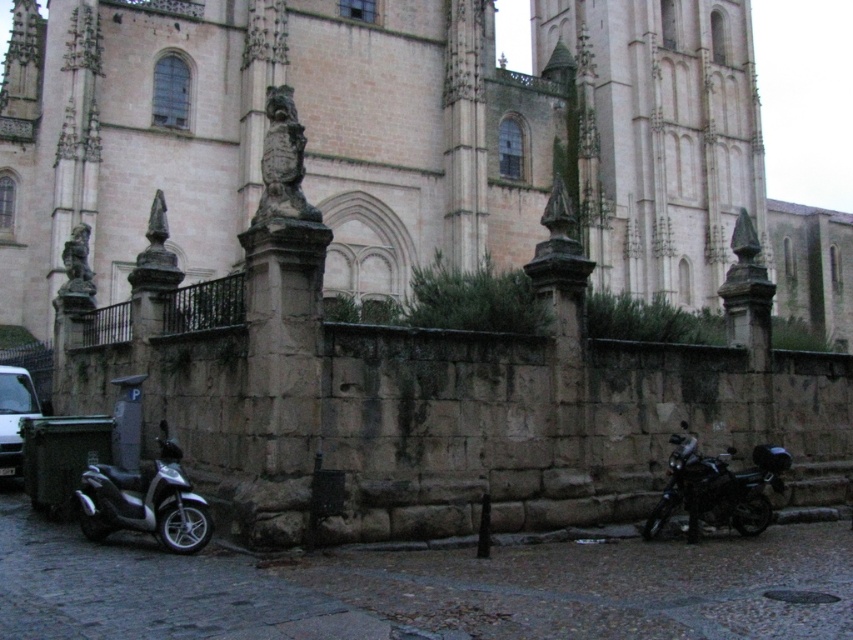
Is point (727, 452) positioned in front of point (3, 467)?

No, (727, 452) is further to viewer.

Which of these two, shiny black motorcycle at lower right or white matte van at lower left, stands shorter?

shiny black motorcycle at lower right is shorter.

Who is more distant from viewer, (722, 458) or (4, 444)?

The point (4, 444) is more distant.

Locate an element on the screen. shiny black motorcycle at lower right is located at coordinates (717, 486).

Can you confirm if silver metallic scooter at lower left is taller than shiny black motorcycle at lower right?

No, silver metallic scooter at lower left is not taller than shiny black motorcycle at lower right.

Where is `silver metallic scooter at lower left`? silver metallic scooter at lower left is located at coordinates (144, 500).

You are a GUI agent. You are given a task and a screenshot of the screen. Output one action in this format:
    pyautogui.click(x=<x>, y=<y>)
    Task: Click on the silver metallic scooter at lower left
    
    Given the screenshot: What is the action you would take?
    pyautogui.click(x=144, y=500)

Does silver metallic scooter at lower left appear over white matte van at lower left?

Incorrect, silver metallic scooter at lower left is not positioned above white matte van at lower left.

Find the location of `silver metallic scooter at lower left`. silver metallic scooter at lower left is located at coordinates (144, 500).